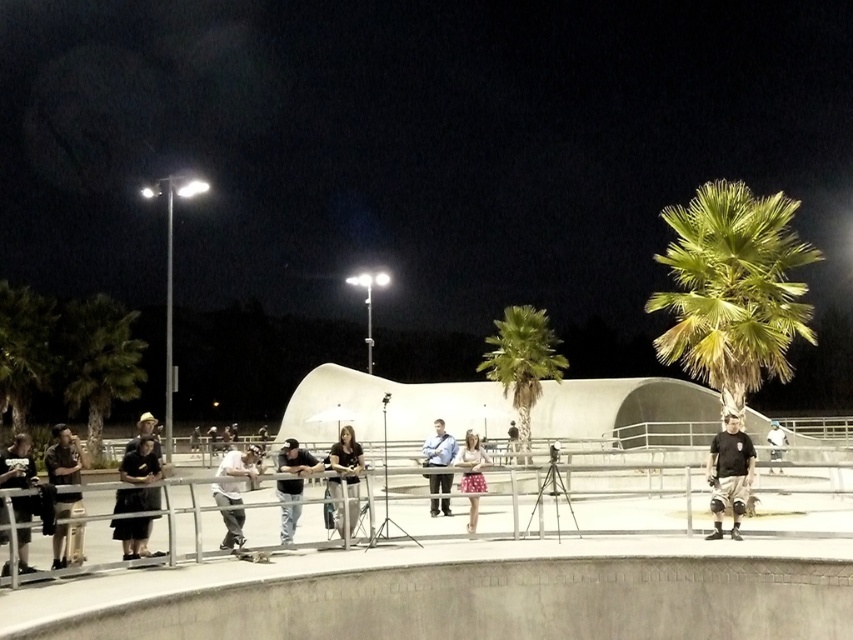
Between green leafy palm tree at left and white cotton t-shirt at center, which one has less height?

With less height is white cotton t-shirt at center.

Is point (108, 396) farther from viewer compared to point (254, 468)?

Yes.

Locate an element on the screen. green leafy palm tree at left is located at coordinates (99, 360).

Which of these two, black matte shirt at lower right or dark gray jeans at center, stands taller?

dark gray jeans at center is taller.

Is black matte shirt at lower right shorter than dark gray jeans at center?

Indeed, black matte shirt at lower right has a lesser height compared to dark gray jeans at center.

Where is `black matte shirt at lower right`? The height and width of the screenshot is (640, 853). black matte shirt at lower right is located at coordinates (729, 474).

Measure the distance between green leafy palm tree at right and brown leather jacket at lower left.

The distance of green leafy palm tree at right from brown leather jacket at lower left is 15.15 meters.

Is point (703, 188) behind point (57, 454)?

Yes, point (703, 188) is behind point (57, 454).

I want to click on green leafy palm tree at right, so click(x=733, y=289).